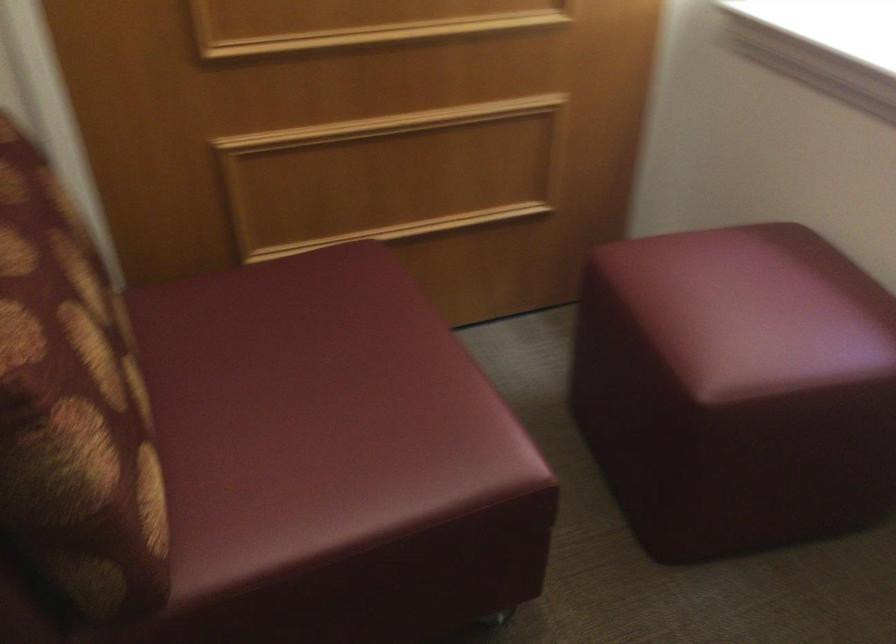
The width and height of the screenshot is (896, 644). What do you see at coordinates (752, 308) in the screenshot? I see `the red chair sitting surface` at bounding box center [752, 308].